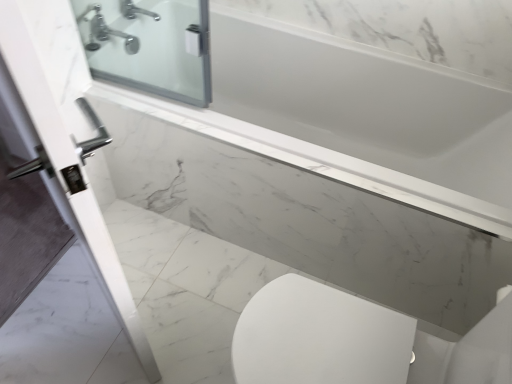
Question: Is white glossy door handle at left not inside silver metallic faucet at upper left?

Choices:
 (A) no
 (B) yes

Answer: (B)

Question: Considering the relative sizes of white glossy door handle at left and silver metallic faucet at upper left in the image provided, is white glossy door handle at left wider than silver metallic faucet at upper left?

Choices:
 (A) yes
 (B) no

Answer: (B)

Question: Does white glossy door handle at left come in front of silver metallic faucet at upper left?

Choices:
 (A) yes
 (B) no

Answer: (A)

Question: Considering the relative sizes of white glossy door handle at left and silver metallic faucet at upper left in the image provided, is white glossy door handle at left smaller than silver metallic faucet at upper left?

Choices:
 (A) yes
 (B) no

Answer: (B)

Question: Is white glossy door handle at left at the left side of silver metallic faucet at upper left?

Choices:
 (A) no
 (B) yes

Answer: (A)

Question: Is point (91, 34) positioned closer to the camera than point (91, 243)?

Choices:
 (A) farther
 (B) closer

Answer: (A)

Question: Considering the relative positions of silver metallic faucet at upper left and white glossy door handle at left in the image provided, is silver metallic faucet at upper left to the left or to the right of white glossy door handle at left?

Choices:
 (A) right
 (B) left

Answer: (B)

Question: In the image, is silver metallic faucet at upper left positioned in front of or behind white glossy door handle at left?

Choices:
 (A) behind
 (B) front

Answer: (A)

Question: Which is correct: silver metallic faucet at upper left is inside white glossy door handle at left, or outside of it?

Choices:
 (A) outside
 (B) inside

Answer: (A)

Question: From the image's perspective, is white marble ledge at upper center positioned above or below white glossy door handle at left?

Choices:
 (A) below
 (B) above

Answer: (A)

Question: Does point coord(493,208) appear closer or farther from the camera than point coord(68,74)?

Choices:
 (A) closer
 (B) farther

Answer: (A)

Question: In the image, is white marble ledge at upper center on the left side or the right side of white glossy door handle at left?

Choices:
 (A) right
 (B) left

Answer: (A)

Question: Based on their sizes in the image, would you say white marble ledge at upper center is bigger or smaller than white glossy door handle at left?

Choices:
 (A) big
 (B) small

Answer: (B)

Question: In terms of size, does white glossy door handle at left appear bigger or smaller than white marble ledge at upper center?

Choices:
 (A) small
 (B) big

Answer: (B)

Question: Choose the correct answer: Is white glossy door handle at left inside white marble ledge at upper center or outside it?

Choices:
 (A) outside
 (B) inside

Answer: (A)